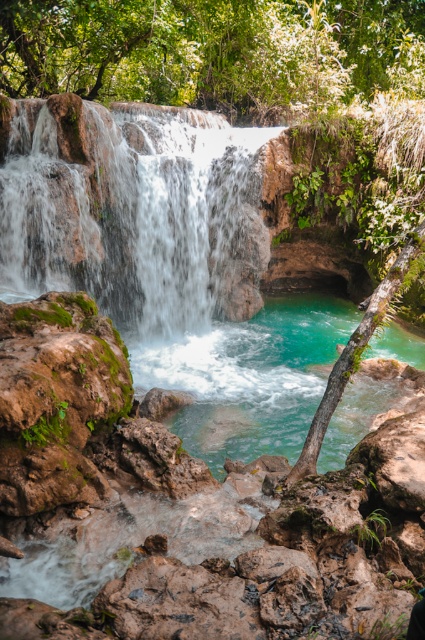
Question: Is translucent white water at center to the left of turquoise glossy water at center from the viewer's perspective?

Choices:
 (A) no
 (B) yes

Answer: (B)

Question: Is the position of translucent white water at center less distant than that of turquoise glossy water at center?

Choices:
 (A) yes
 (B) no

Answer: (B)

Question: Which of the following is the closest to the observer?

Choices:
 (A) turquoise glossy water at center
 (B) translucent white water at center

Answer: (A)

Question: From the image, what is the correct spatial relationship of translucent white water at center in relation to turquoise glossy water at center?

Choices:
 (A) below
 (B) above

Answer: (B)